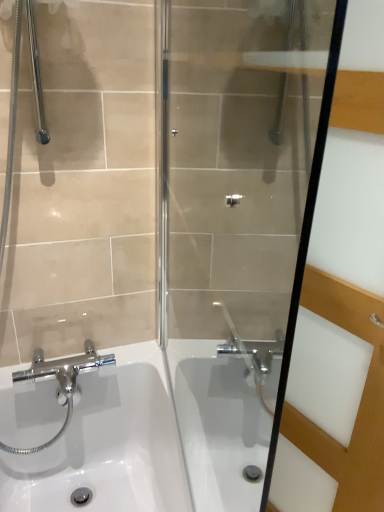
Question: Is white glossy sink at lower left positioned behind transparent glass shower door at center?

Choices:
 (A) no
 (B) yes

Answer: (B)

Question: Does white glossy sink at lower left have a greater width compared to transparent glass shower door at center?

Choices:
 (A) yes
 (B) no

Answer: (A)

Question: Is white glossy sink at lower left smaller than transparent glass shower door at center?

Choices:
 (A) yes
 (B) no

Answer: (B)

Question: Does white glossy sink at lower left appear on the right side of transparent glass shower door at center?

Choices:
 (A) no
 (B) yes

Answer: (A)

Question: Considering the relative sizes of white glossy sink at lower left and transparent glass shower door at center in the image provided, is white glossy sink at lower left thinner than transparent glass shower door at center?

Choices:
 (A) yes
 (B) no

Answer: (B)

Question: Considering the positions of transparent glass shower door at center and transparent glass screen door at center in the image, is transparent glass shower door at center bigger or smaller than transparent glass screen door at center?

Choices:
 (A) big
 (B) small

Answer: (B)

Question: Is transparent glass shower door at center wider or thinner than transparent glass screen door at center?

Choices:
 (A) thin
 (B) wide

Answer: (A)

Question: Is point (230, 218) positioned closer to the camera than point (372, 182)?

Choices:
 (A) farther
 (B) closer

Answer: (A)

Question: Which is correct: transparent glass shower door at center is inside transparent glass screen door at center, or outside of it?

Choices:
 (A) inside
 (B) outside

Answer: (B)

Question: Is white glossy sink at lower left taller or shorter than transparent glass shower door at center?

Choices:
 (A) short
 (B) tall

Answer: (A)

Question: From a real-world perspective, is white glossy sink at lower left above or below transparent glass shower door at center?

Choices:
 (A) below
 (B) above

Answer: (A)

Question: Considering the positions of point (36, 460) and point (188, 320), is point (36, 460) closer or farther from the camera than point (188, 320)?

Choices:
 (A) farther
 (B) closer

Answer: (B)

Question: From the image's perspective, is white glossy sink at lower left positioned above or below transparent glass shower door at center?

Choices:
 (A) below
 (B) above

Answer: (A)

Question: Considering the positions of white glossy sink at lower left and transparent glass screen door at center in the image, is white glossy sink at lower left bigger or smaller than transparent glass screen door at center?

Choices:
 (A) small
 (B) big

Answer: (B)

Question: In terms of height, does white glossy sink at lower left look taller or shorter compared to transparent glass screen door at center?

Choices:
 (A) tall
 (B) short

Answer: (B)